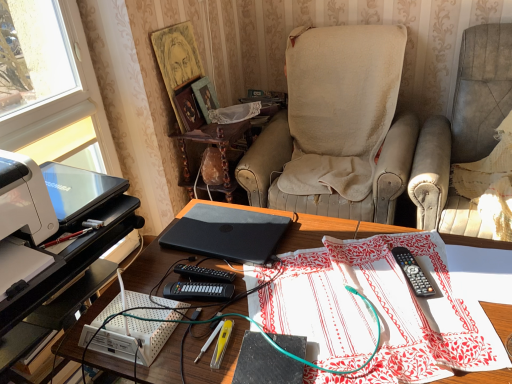
Locate an element on the screen. This screenshot has width=512, height=384. vacant region below orange matte laptop at center, placed as the 2th laptop when sorted from left to right (from a real-world perspective) is located at coordinates (232, 230).